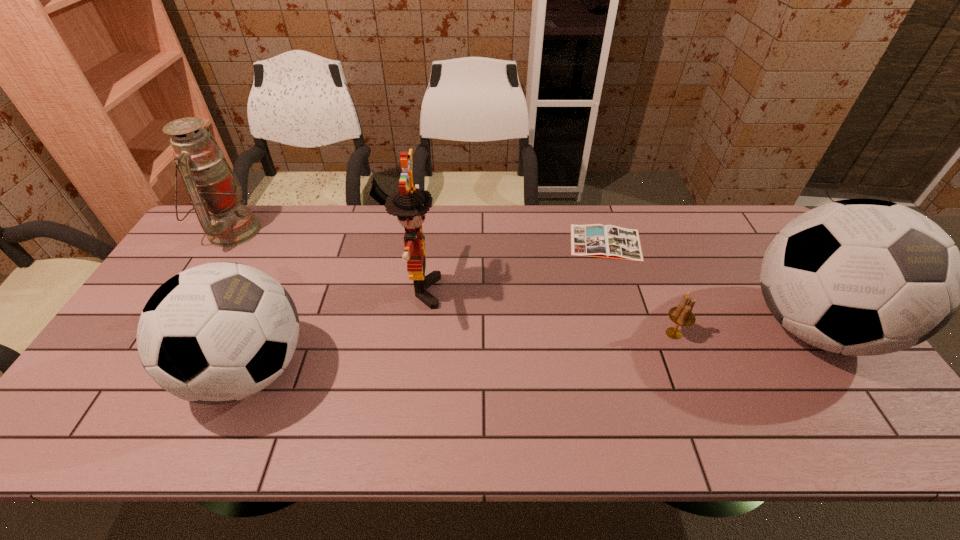
Image resolution: width=960 pixels, height=540 pixels. In order to click on vacant position for inserting another soccer_ball evenly in this screenshot , I will do `click(542, 348)`.